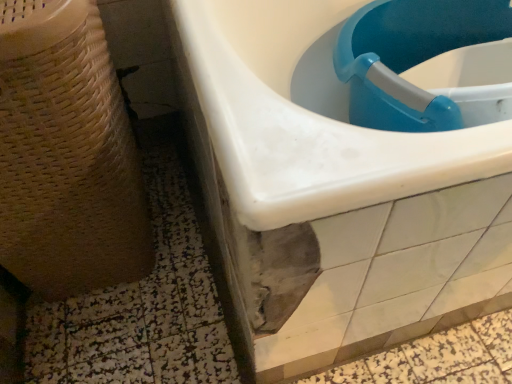
Question: Is blue plastic sink at upper right, which is the first sink in left-to-right order, to the right of beige woven basket at left from the viewer's perspective?

Choices:
 (A) no
 (B) yes

Answer: (B)

Question: Could you tell me if blue plastic sink at upper right, which is the first sink in left-to-right order, is turned towards beige woven basket at left?

Choices:
 (A) yes
 (B) no

Answer: (B)

Question: From the image's perspective, does blue plastic sink at upper right, which is the first sink in left-to-right order, appear lower than beige woven basket at left?

Choices:
 (A) yes
 (B) no

Answer: (B)

Question: Is blue plastic sink at upper right, marked as the 2th sink in a right-to-left arrangement, next to beige woven basket at left and touching it?

Choices:
 (A) no
 (B) yes

Answer: (A)

Question: From a real-world perspective, is blue plastic sink at upper right, marked as the 2th sink in a right-to-left arrangement, under beige woven basket at left?

Choices:
 (A) yes
 (B) no

Answer: (A)

Question: Choose the correct answer: Is beige woven basket at left inside blue plastic sink at upper right, the first sink positioned from the right, or outside it?

Choices:
 (A) outside
 (B) inside

Answer: (A)

Question: Considering the relative positions of beige woven basket at left and blue plastic sink at upper right, the first sink positioned from the right, in the image provided, is beige woven basket at left to the left or to the right of blue plastic sink at upper right, the first sink positioned from the right,?

Choices:
 (A) right
 (B) left

Answer: (B)

Question: Considering the positions of beige woven basket at left and blue plastic sink at upper right, marked as the 2th sink in a left-to-right arrangement, in the image, is beige woven basket at left wider or thinner than blue plastic sink at upper right, marked as the 2th sink in a left-to-right arrangement,?

Choices:
 (A) wide
 (B) thin

Answer: (A)

Question: From the image's perspective, is beige woven basket at left located above or below blue plastic sink at upper right, the first sink positioned from the right?

Choices:
 (A) below
 (B) above

Answer: (A)

Question: Visually, is blue plastic sink at upper right, marked as the 2th sink in a right-to-left arrangement, positioned to the left or to the right of beige woven basket at left?

Choices:
 (A) left
 (B) right

Answer: (B)

Question: Considering their positions, is blue plastic sink at upper right, which is the first sink in left-to-right order, located in front of or behind beige woven basket at left?

Choices:
 (A) front
 (B) behind

Answer: (B)

Question: Considering the positions of blue plastic sink at upper right, marked as the 2th sink in a right-to-left arrangement, and beige woven basket at left in the image, is blue plastic sink at upper right, marked as the 2th sink in a right-to-left arrangement, taller or shorter than beige woven basket at left?

Choices:
 (A) tall
 (B) short

Answer: (B)

Question: Looking at their shapes, would you say blue plastic sink at upper right, which is the first sink in left-to-right order, is wider or thinner than beige woven basket at left?

Choices:
 (A) thin
 (B) wide

Answer: (B)

Question: Would you say beige woven basket at left is to the left or to the right of blue plastic sink at upper right, marked as the 2th sink in a right-to-left arrangement, in the picture?

Choices:
 (A) right
 (B) left

Answer: (B)

Question: Is beige woven basket at left spatially inside blue plastic sink at upper right, which is the first sink in left-to-right order, or outside of it?

Choices:
 (A) inside
 (B) outside

Answer: (B)